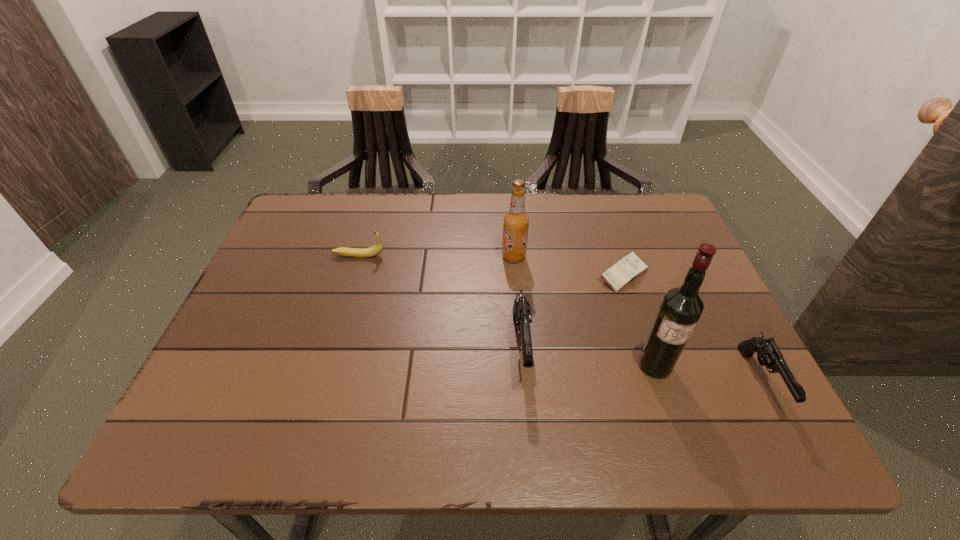
Where is `the third tallest object`? The image size is (960, 540). the third tallest object is located at coordinates (521, 307).

Find the location of `the left gun`. the left gun is located at coordinates (521, 307).

Where is `the rightmost object`? The height and width of the screenshot is (540, 960). the rightmost object is located at coordinates click(x=768, y=354).

This screenshot has height=540, width=960. I want to click on the shorter gun, so click(x=768, y=354).

Where is `the shortest object`? the shortest object is located at coordinates (628, 268).

Identify the location of banana. This screenshot has height=540, width=960. (378, 247).

You are a GUI agent. You are given a task and a screenshot of the screen. Output one action in this format:
    pyautogui.click(x=<x>, y=<y>)
    Task: Click on the wine bottle
    The height and width of the screenshot is (540, 960).
    Given the screenshot: What is the action you would take?
    pyautogui.click(x=681, y=307)

The image size is (960, 540). I want to click on the second tallest object, so click(x=516, y=221).

You are a GUI agent. You are given a task and a screenshot of the screen. Output one action in this format:
    pyautogui.click(x=<x>, y=<y>)
    Task: Click on the vacant region located on the front of the shortest object
    Image resolution: width=960 pixels, height=540 pixels.
    Given the screenshot: What is the action you would take?
    pyautogui.click(x=651, y=356)

Locate an element on the screen. vacant space located 0.070m at the stem of the banana is located at coordinates (411, 255).